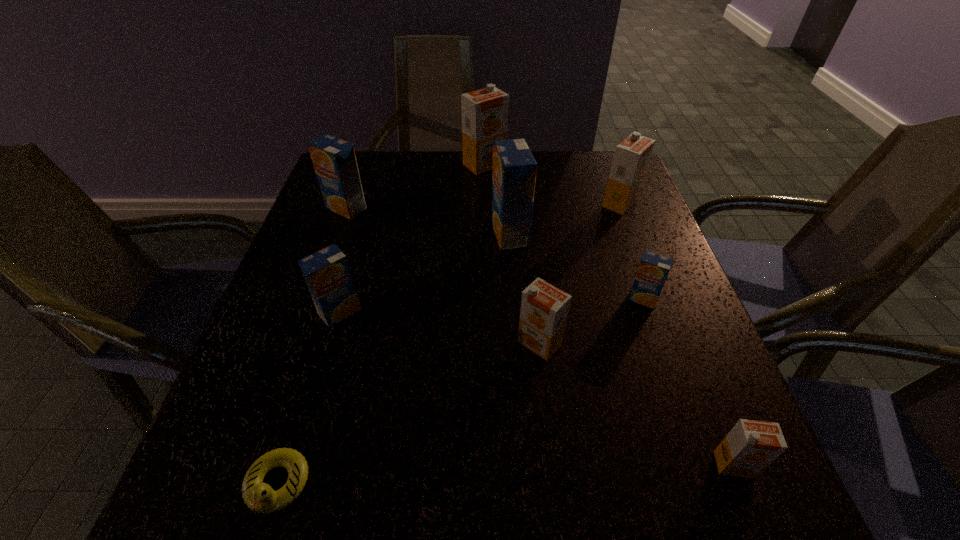
The height and width of the screenshot is (540, 960). Find the location of `the farthest orange juice`. the farthest orange juice is located at coordinates (485, 111).

At what (x,y) coordinates should I click in order to perform the action: click on the farthest object. Please return your answer as a coordinate pair (x, y). The height and width of the screenshot is (540, 960). Looking at the image, I should click on 485,111.

At what (x,y) coordinates should I click in order to perform the action: click on the biggest blue orange_juice. Please return your answer as a coordinate pair (x, y). Looking at the image, I should click on pyautogui.click(x=514, y=168).

Where is `the third smallest blue orange_juice`? the third smallest blue orange_juice is located at coordinates (334, 160).

Locate an element on the screen. The height and width of the screenshot is (540, 960). the second farthest orange orange juice is located at coordinates (631, 158).

You are a GUI agent. You are given a task and a screenshot of the screen. Output one action in this format:
    pyautogui.click(x=<x>, y=<y>)
    Task: Click on the second smallest blue orange_juice
    The image size is (960, 540).
    Given the screenshot: What is the action you would take?
    pyautogui.click(x=327, y=273)

Identify the location of the second nearest orange orange juice. (544, 308).

Identify the location of the smallest blue orange_juice. (653, 270).

Identify the location of the nearest orange juice. (751, 446).

Identify the location of the nearest orange orange juice. The image size is (960, 540). (751, 446).